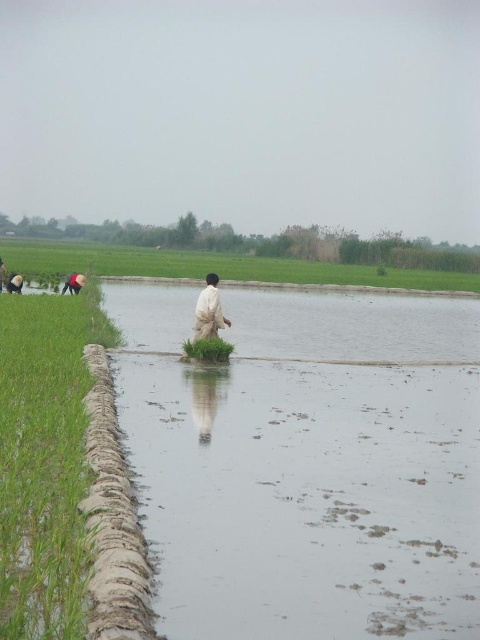
Between white cotton shirt at center and green grass at center, which one has less height?

green grass at center

Does white cotton shirt at center appear on the left side of green grass at center?

In fact, white cotton shirt at center is to the right of green grass at center.

Where is `white cotton shirt at center`? Image resolution: width=480 pixels, height=640 pixels. white cotton shirt at center is located at coordinates (208, 310).

Who is positioned more to the right, green grass at lower left or white cotton shirt at center?

white cotton shirt at center is more to the right.

How far apart are green grass at lower left and white cotton shirt at center?

green grass at lower left and white cotton shirt at center are 40.09 meters apart from each other.

Between point (164, 252) and point (206, 291), which one is positioned in front?

Point (206, 291) is more forward.

Find the location of a particular element. green grass at lower left is located at coordinates (211, 266).

Between point (478, 285) and point (81, 280), which one is positioned behind?

The point (478, 285) is more distant.

Which is below, green grass at lower left or matte black person at lower left?

matte black person at lower left is lower down.

This screenshot has width=480, height=640. In order to click on green grass at lower left in this screenshot , I will do `click(211, 266)`.

Locate an element on the screen. The image size is (480, 640). green grass at lower left is located at coordinates (211, 266).